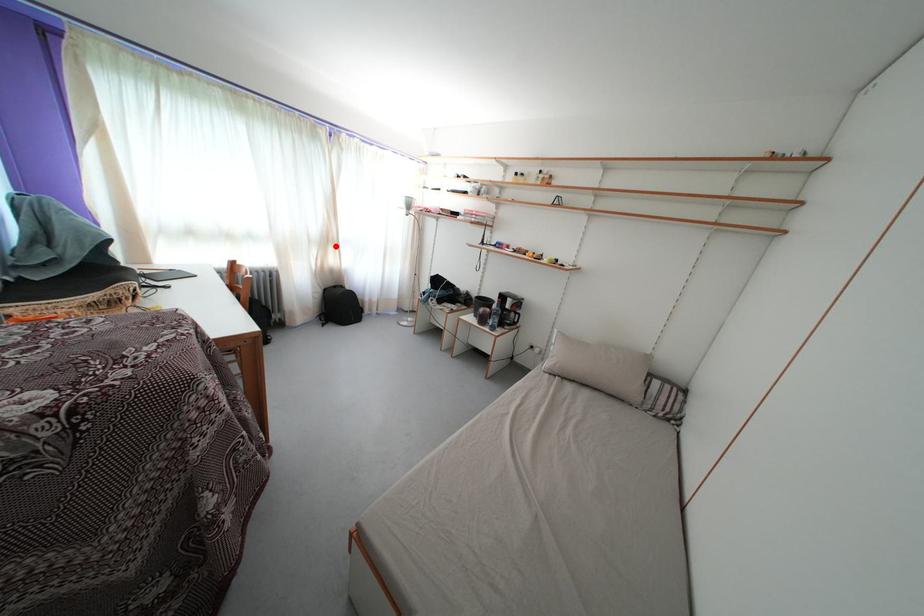
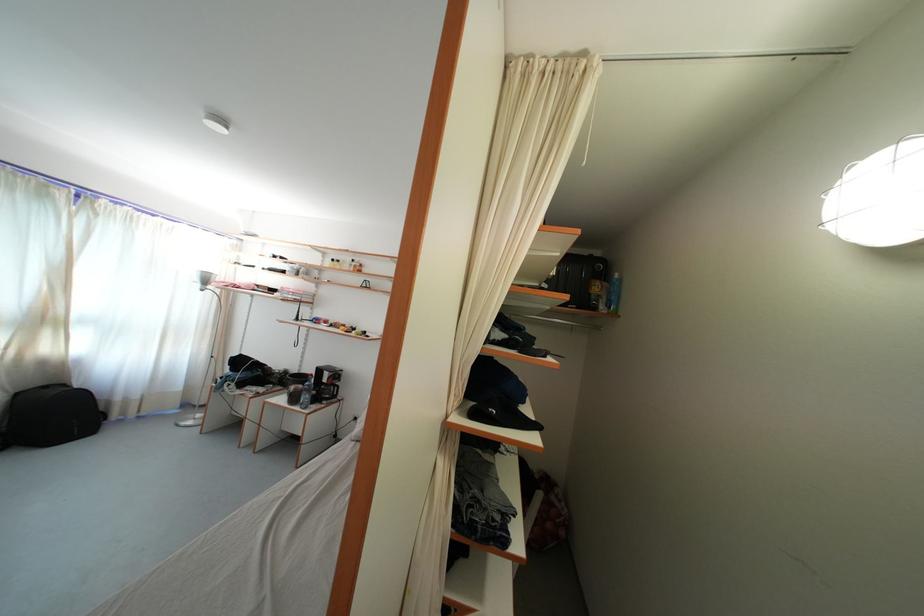
Locate, in the second image, the point that corresponds to the highlighted location in the first image.

(52, 326)